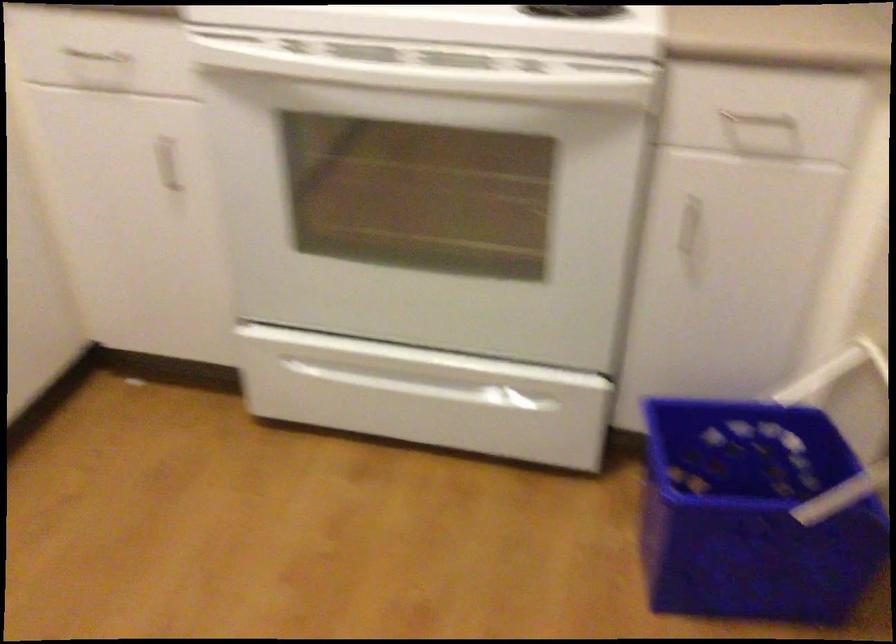
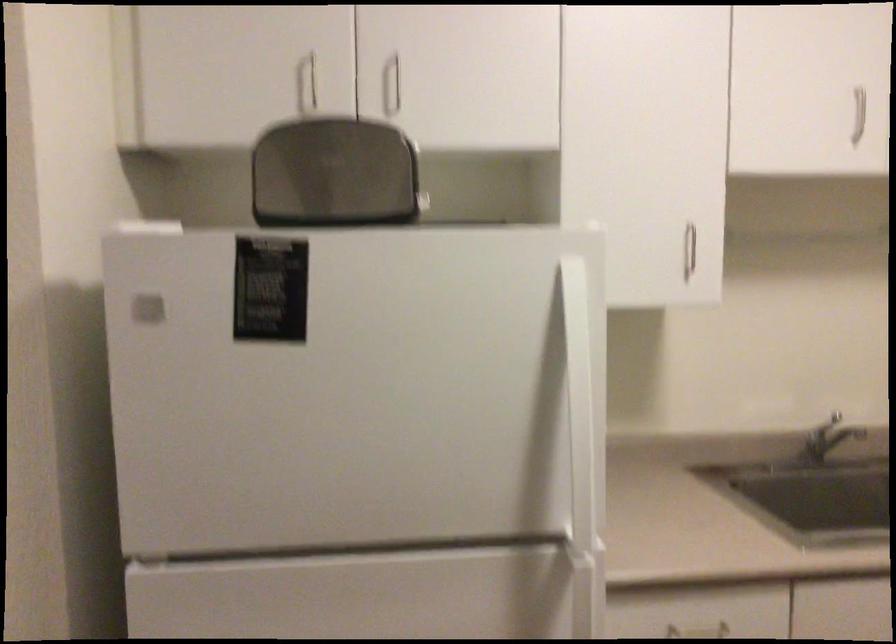
Question: The first image is from the beginning of the video and the second image is from the end. How did the camera likely rotate when shooting the video?

Choices:
 (A) Left
 (B) Right
 (C) Up
 (D) Down

Answer: (A)